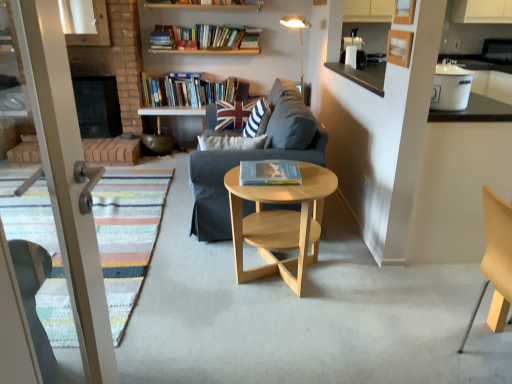
The width and height of the screenshot is (512, 384). I want to click on free space to the left of natural wood coffee table at center, so click(186, 280).